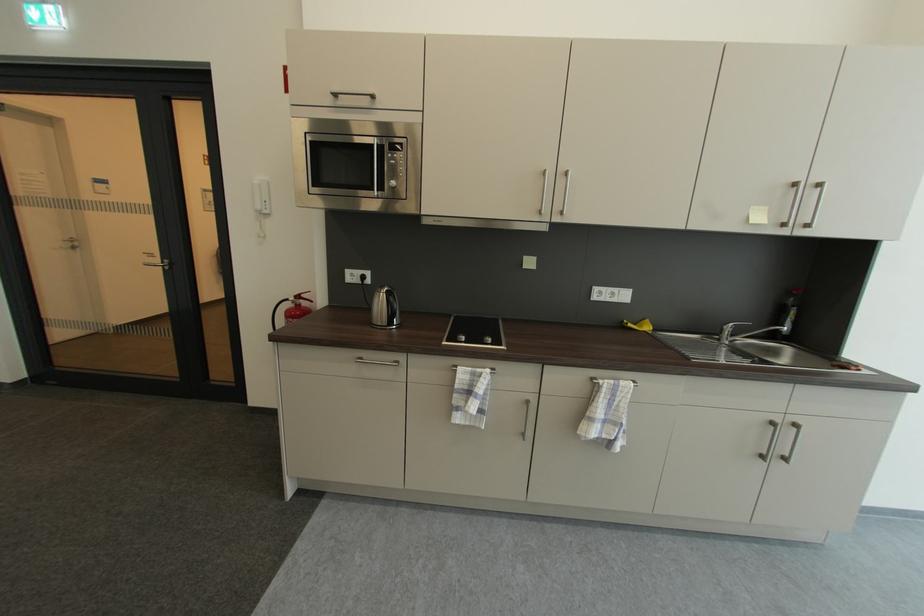
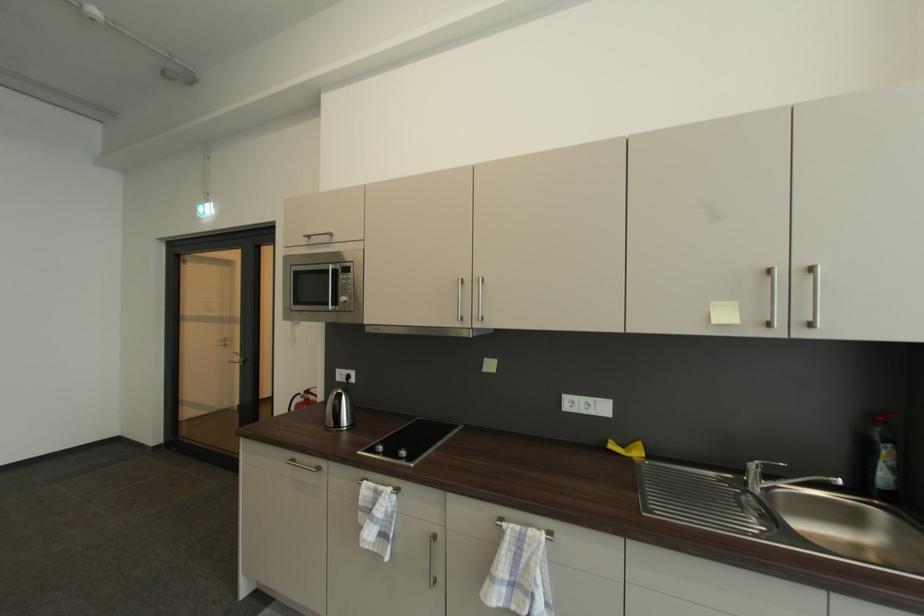
Where in the second image is the point corresponding to pixel 604 385 from the first image?

(507, 529)